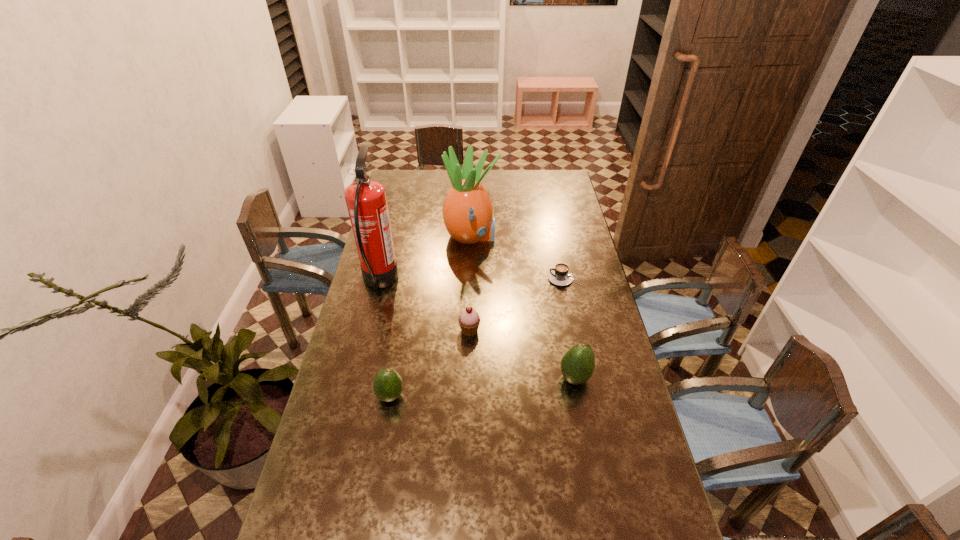
Image resolution: width=960 pixels, height=540 pixels. What are the coordinates of `vacant position in the image that satisfies the following two spatial constraints: 1. at the entrance of the pineapple; 2. on the back side of the third tallest object` in the screenshot? It's located at (468, 377).

Find the location of a particular element. Image resolution: width=960 pixels, height=540 pixels. free space that satisfies the following two spatial constraints: 1. at the entrance of the pineapple; 2. on the left side of the taller avocado is located at coordinates (468, 377).

Locate an element on the screen. The image size is (960, 540). vacant space that satisfies the following two spatial constraints: 1. at the entrance of the right avocado; 2. on the left side of the farthest object is located at coordinates (468, 377).

Find the location of a particular element. vacant space that satisfies the following two spatial constraints: 1. on the front-facing side of the tallest object; 2. on the left side of the cupcake is located at coordinates (368, 330).

Find the location of a particular element. This screenshot has width=960, height=540. free location that satisfies the following two spatial constraints: 1. on the front side of the right avocado; 2. on the left side of the cupcake is located at coordinates (468, 377).

Where is `free location that satisfies the following two spatial constraints: 1. on the back side of the left avocado; 2. on the left side of the third nearest object`? free location that satisfies the following two spatial constraints: 1. on the back side of the left avocado; 2. on the left side of the third nearest object is located at coordinates (401, 330).

The height and width of the screenshot is (540, 960). What are the coordinates of `free space that satisfies the following two spatial constraints: 1. at the entrance of the farthest object; 2. on the left side of the fourth shortest object` in the screenshot? It's located at (468, 377).

You are a GUI agent. You are given a task and a screenshot of the screen. Output one action in this format:
    pyautogui.click(x=<x>, y=<y>)
    Task: Click on the free space that satisfies the following two spatial constraints: 1. on the back side of the cupcake; 2. on the right side of the left avocado
    This screenshot has width=960, height=540.
    Given the screenshot: What is the action you would take?
    pyautogui.click(x=401, y=330)

In order to click on free spot that satisfies the following two spatial constraints: 1. at the entrance of the second tallest object; 2. on the right side of the fourth shortest object in this screenshot , I will do `click(468, 377)`.

The width and height of the screenshot is (960, 540). What are the coordinates of `vacant region that satisfies the following two spatial constraints: 1. on the front-facing side of the right avocado; 2. on the right side of the leftmost object` in the screenshot? It's located at (356, 377).